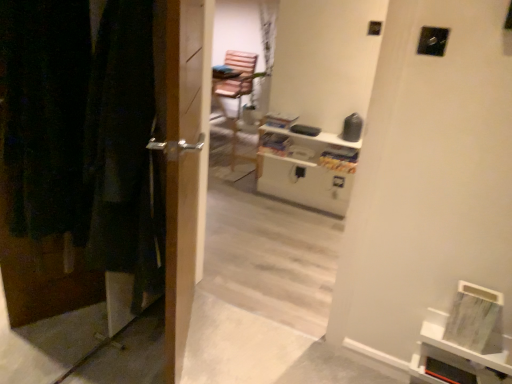
Find the location of a particular element. This screenshot has height=384, width=512. white glossy entertainment center at upper center is located at coordinates pyautogui.click(x=307, y=168).

This screenshot has height=384, width=512. What do you see at coordinates (191, 159) in the screenshot?
I see `metallic silver handle at left` at bounding box center [191, 159].

Describe the element at coordinates (464, 341) in the screenshot. I see `white matte bookshelf at lower right` at that location.

The image size is (512, 384). What do you see at coordinates (44, 157) in the screenshot?
I see `wooden door at left` at bounding box center [44, 157].

Locate an element on the screen. white glossy entertainment center at upper center is located at coordinates (307, 168).

Is metallic silver handle at left aimed at white matte bookshelf at lower right?

Yes, metallic silver handle at left faces towards white matte bookshelf at lower right.

Is metallic silver handle at left not close to white matte bookshelf at lower right?

Absolutely, metallic silver handle at left is distant from white matte bookshelf at lower right.

Is point (195, 210) positioned after point (466, 366)?

No, (195, 210) is in front of (466, 366).

In terms of size, does metallic silver handle at left appear bigger or smaller than white matte bookshelf at lower right?

Considering their sizes, metallic silver handle at left takes up more space than white matte bookshelf at lower right.

From a real-world perspective, is white glossy entertainment center at upper center below white matte bookshelf at lower right?

No, from a real-world perspective, white glossy entertainment center at upper center is not under white matte bookshelf at lower right.

Between white glossy entertainment center at upper center and white matte bookshelf at lower right, which one has smaller size?

With smaller size is white matte bookshelf at lower right.

Between white glossy entertainment center at upper center and white matte bookshelf at lower right, which one has smaller width?

Thinner between the two is white matte bookshelf at lower right.

Where is `shelf that appears below the white glossy entertainment center at upper center (from the image's perspective)`? shelf that appears below the white glossy entertainment center at upper center (from the image's perspective) is located at coordinates (464, 341).

Can you confirm if wooden door at left is smaller than white matte bookshelf at lower right?

No, wooden door at left is not smaller than white matte bookshelf at lower right.

This screenshot has width=512, height=384. I want to click on door above the white matte bookshelf at lower right (from the image's perspective), so click(x=44, y=157).

Could you tell me if wooden door at left is turned towards white matte bookshelf at lower right?

Yes, wooden door at left faces towards white matte bookshelf at lower right.

Could white matte bookshelf at lower right be considered to be inside wooden door at left?

No, white matte bookshelf at lower right is not inside wooden door at left.

From the image's perspective, would you say wooden door at left is positioned over white glossy entertainment center at upper center?

No, from the image's perspective, wooden door at left is not above white glossy entertainment center at upper center.

Who is taller, wooden door at left or white glossy entertainment center at upper center?

wooden door at left.

Which object is wider, wooden door at left or white glossy entertainment center at upper center?

Wider between the two is white glossy entertainment center at upper center.

Could you tell me if wooden door at left is turned towards white glossy entertainment center at upper center?

No, wooden door at left is not oriented towards white glossy entertainment center at upper center.

How much distance is there between metallic silver handle at left and white glossy entertainment center at upper center?

metallic silver handle at left and white glossy entertainment center at upper center are 1.56 meters apart from each other.

Can you confirm if metallic silver handle at left is shorter than white glossy entertainment center at upper center?

Incorrect, the height of metallic silver handle at left does not fall short of that of white glossy entertainment center at upper center.

Looking at this image, from a real-world perspective, is metallic silver handle at left physically located above or below white glossy entertainment center at upper center?

metallic silver handle at left is above white glossy entertainment center at upper center.

The image size is (512, 384). What are the coordinates of `entertainment center above the metallic silver handle at left (from the image's perspective)` in the screenshot? It's located at (307, 168).

Is white glossy entertainment center at upper center shorter than wooden door at left?

Indeed, white glossy entertainment center at upper center has a lesser height compared to wooden door at left.

From a real-world perspective, who is located lower, white glossy entertainment center at upper center or wooden door at left?

From a 3D spatial view, white glossy entertainment center at upper center is below.

How different are the orientations of white glossy entertainment center at upper center and wooden door at left in degrees?

The angular difference between white glossy entertainment center at upper center and wooden door at left is 90 degrees.

Could you tell me if white glossy entertainment center at upper center is turned towards wooden door at left?

Yes, white glossy entertainment center at upper center faces towards wooden door at left.

Looking at this image, from the image's perspective, is white matte bookshelf at lower right on top of wooden door at left?

Incorrect, from the image's perspective, white matte bookshelf at lower right is lower than wooden door at left.

Considering the positions of objects white matte bookshelf at lower right and wooden door at left in the image provided, who is more to the right, white matte bookshelf at lower right or wooden door at left?

Positioned to the right is white matte bookshelf at lower right.

Is white matte bookshelf at lower right facing towards wooden door at left?

No, white matte bookshelf at lower right is not aimed at wooden door at left.

How distant is white matte bookshelf at lower right from wooden door at left?

white matte bookshelf at lower right is 5.06 feet away from wooden door at left.

The image size is (512, 384). Find the location of `screen door that appears above the white matte bookshelf at lower right (from a real-world perspective)`. screen door that appears above the white matte bookshelf at lower right (from a real-world perspective) is located at coordinates (191, 159).

Find the location of `shelf located underneath the white glossy entertainment center at upper center (from a real-world perspective)`. shelf located underneath the white glossy entertainment center at upper center (from a real-world perspective) is located at coordinates (464, 341).

Considering their positions, is wooden door at left positioned further to white matte bookshelf at lower right than white glossy entertainment center at upper center?

white glossy entertainment center at upper center lies further to white matte bookshelf at lower right than the other object.

Based on their spatial positions, is white matte bookshelf at lower right or white glossy entertainment center at upper center further from metallic silver handle at left?

white glossy entertainment center at upper center is further to metallic silver handle at left.

Considering their positions, is wooden door at left positioned further to white glossy entertainment center at upper center than white matte bookshelf at lower right?

wooden door at left.

From the image, which object appears to be nearer to wooden door at left, metallic silver handle at left or white glossy entertainment center at upper center?

The object closer to wooden door at left is metallic silver handle at left.

Looking at the image, which one is located further to metallic silver handle at left, wooden door at left or white matte bookshelf at lower right?

white matte bookshelf at lower right is positioned further to the anchor metallic silver handle at left.

Based on their spatial positions, is white matte bookshelf at lower right or wooden door at left closer to white glossy entertainment center at upper center?

The object closer to white glossy entertainment center at upper center is white matte bookshelf at lower right.

Looking at the image, which one is located closer to white matte bookshelf at lower right, metallic silver handle at left or wooden door at left?

Based on the image, metallic silver handle at left appears to be nearer to white matte bookshelf at lower right.

When comparing their distances from white matte bookshelf at lower right, does white glossy entertainment center at upper center or wooden door at left seem further?

The object further to white matte bookshelf at lower right is white glossy entertainment center at upper center.

At what (x,y) coordinates should I click in order to perform the action: click on screen door between wooden door at left and white matte bookshelf at lower right. Please return your answer as a coordinate pair (x, y). This screenshot has width=512, height=384. Looking at the image, I should click on (191, 159).

Where is `screen door located between wooden door at left and white glossy entertainment center at upper center in the depth direction`? The width and height of the screenshot is (512, 384). screen door located between wooden door at left and white glossy entertainment center at upper center in the depth direction is located at coordinates (191, 159).

The width and height of the screenshot is (512, 384). What are the coordinates of `shelf between wooden door at left and white glossy entertainment center at upper center from front to back` in the screenshot? It's located at (464, 341).

You are a GUI agent. You are given a task and a screenshot of the screen. Output one action in this format:
    pyautogui.click(x=<x>, y=<y>)
    Task: Click on the shelf positioned between metallic silver handle at left and white glossy entertainment center at upper center from near to far
    The height and width of the screenshot is (384, 512).
    Given the screenshot: What is the action you would take?
    pyautogui.click(x=464, y=341)